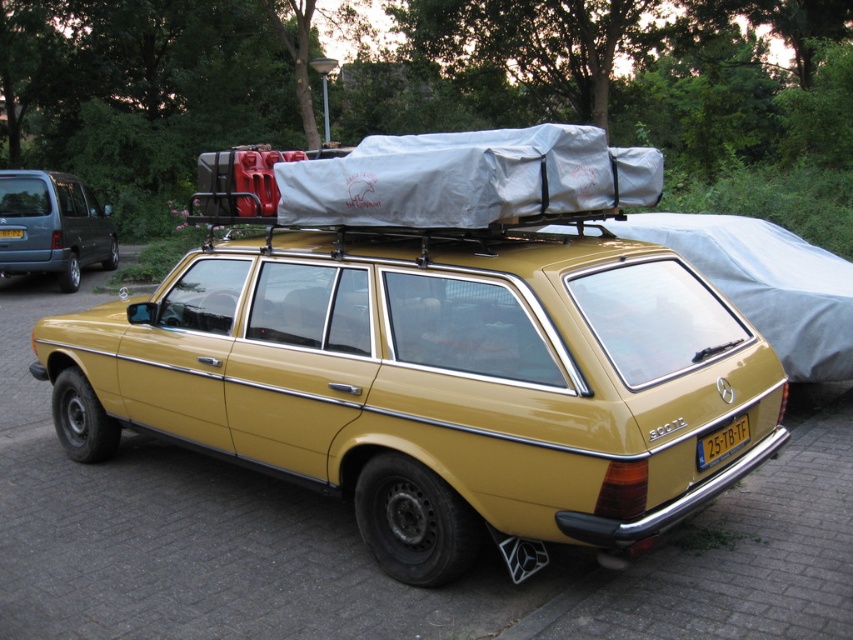
Can you confirm if metallic gray minivan at left is positioned to the right of yellow plastic license plate at lower right?

Incorrect, metallic gray minivan at left is not on the right side of yellow plastic license plate at lower right.

Image resolution: width=853 pixels, height=640 pixels. Describe the element at coordinates (53, 227) in the screenshot. I see `metallic gray minivan at left` at that location.

I want to click on metallic gray minivan at left, so click(x=53, y=227).

Measure the distance between gold matte station wagon at center and yellow plastic license plate at rear.

gold matte station wagon at center and yellow plastic license plate at rear are 35.51 feet apart from each other.

Between gold matte station wagon at center and yellow plastic license plate at rear, which one is positioned lower?

Positioned lower is gold matte station wagon at center.

The width and height of the screenshot is (853, 640). What are the coordinates of `gold matte station wagon at center` in the screenshot? It's located at (434, 384).

Between yellow plastic license plate at lower right and yellow plastic license plate at rear, which one is positioned higher?

yellow plastic license plate at rear is higher up.

The height and width of the screenshot is (640, 853). In order to click on yellow plastic license plate at lower right in this screenshot , I will do `click(722, 442)`.